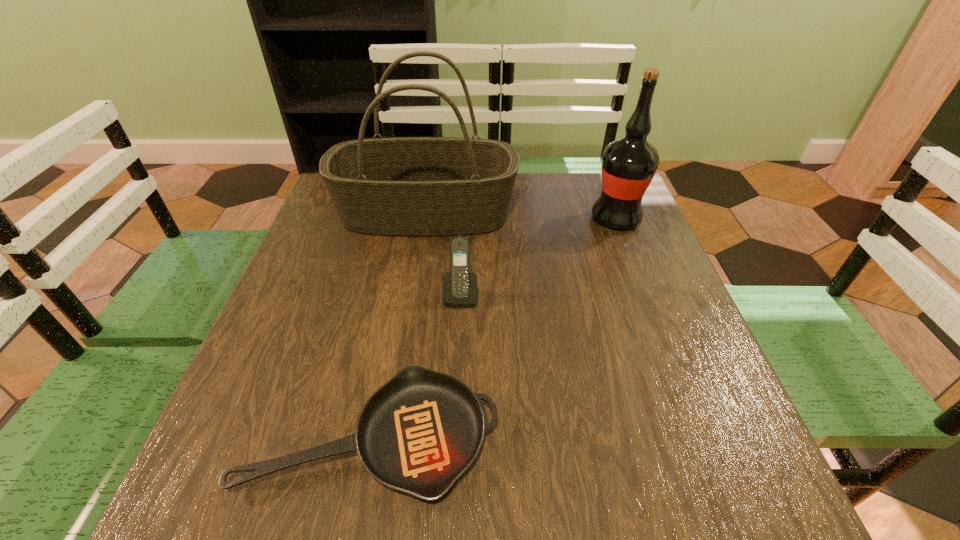
Where is `wine bottle that is at the far edge`? wine bottle that is at the far edge is located at coordinates (629, 164).

Find the location of a particular element. basket present at the far edge is located at coordinates (399, 186).

Where is `object at the near edge`? object at the near edge is located at coordinates (418, 433).

At what (x,y) coordinates should I click in order to perform the action: click on basket that is at the left edge. Please return your answer as a coordinate pair (x, y). Looking at the image, I should click on (399, 186).

The height and width of the screenshot is (540, 960). Find the location of `frying pan present at the left edge`. frying pan present at the left edge is located at coordinates (418, 433).

This screenshot has width=960, height=540. Identify the location of object present at the right edge. (629, 164).

Find the location of a particular element. object present at the far left corner is located at coordinates (399, 186).

I want to click on object at the near left corner, so click(418, 433).

Locate an element on the screen. The image size is (960, 540). object located in the far right corner section of the desktop is located at coordinates (629, 164).

Where is `vacant space at the far edge of the desktop`? This screenshot has height=540, width=960. vacant space at the far edge of the desktop is located at coordinates (551, 186).